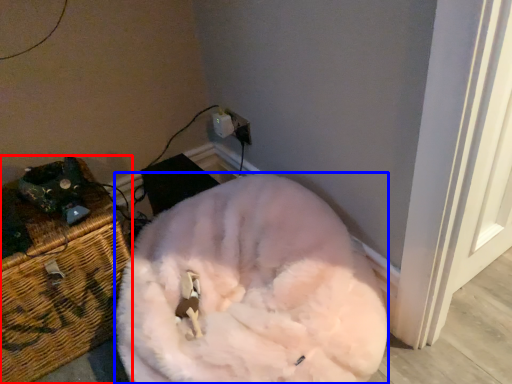
Question: Among these objects, which one is nearest to the camera, furniture (highlighted by a red box) or animal (highlighted by a blue box)?

Choices:
 (A) furniture
 (B) animal

Answer: (B)